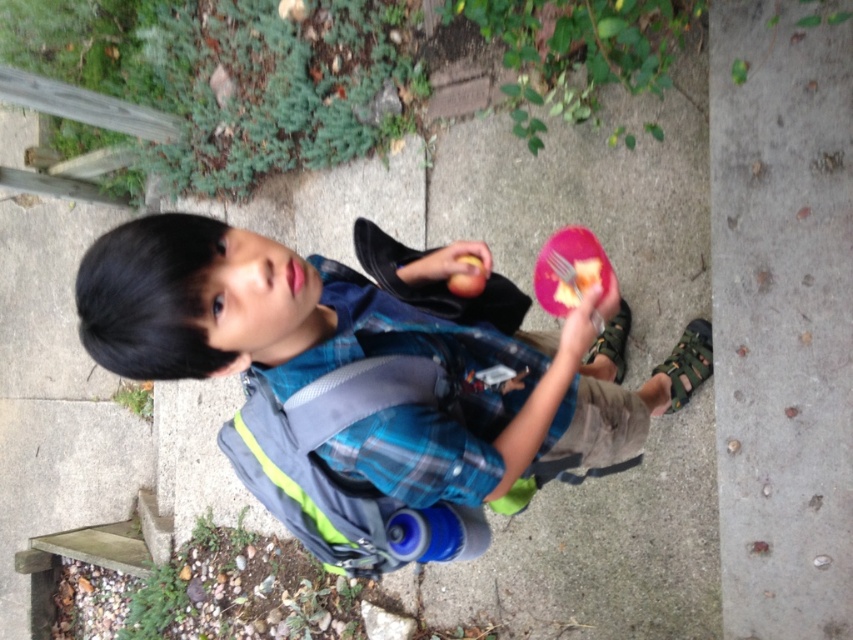
Is blue plaid shirt at center wider than pink plastic fork at upper center?

Yes, blue plaid shirt at center is wider than pink plastic fork at upper center.

Between blue plaid shirt at center and pink plastic fork at upper center, which one appears on the right side from the viewer's perspective?

From the viewer's perspective, pink plastic fork at upper center appears more on the right side.

Where is `blue plaid shirt at center`? This screenshot has height=640, width=853. blue plaid shirt at center is located at coordinates (375, 381).

From the picture: Measure the distance from blue plaid shirt at center to gray concrete at lower right.

A distance of 21.97 inches exists between blue plaid shirt at center and gray concrete at lower right.

Can you confirm if blue plaid shirt at center is positioned below gray concrete at lower right?

Indeed, blue plaid shirt at center is positioned under gray concrete at lower right.

Which is in front, point (343, 356) or point (720, 51)?

Point (343, 356) is more forward.

Identify the location of blue plaid shirt at center. The width and height of the screenshot is (853, 640). (375, 381).

Which of these two, gray concrete at lower right or pink plastic fork at upper center, stands taller?

Standing taller between the two is gray concrete at lower right.

Can you confirm if gray concrete at lower right is taller than pink plastic fork at upper center?

Indeed, gray concrete at lower right has a greater height compared to pink plastic fork at upper center.

Does point (723, 470) come farther from viewer compared to point (585, 252)?

No, it is not.

This screenshot has height=640, width=853. In order to click on gray concrete at lower right in this screenshot , I will do `click(781, 321)`.